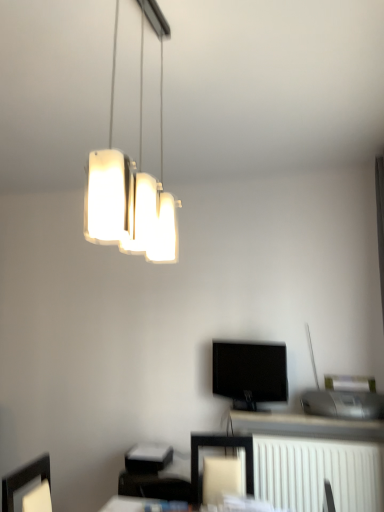
Question: Considering the positions of white plastic radiator at lower right and matte black frame at lower center in the image, is white plastic radiator at lower right wider or thinner than matte black frame at lower center?

Choices:
 (A) wide
 (B) thin

Answer: (B)

Question: Choose the correct answer: Is white plastic radiator at lower right inside matte black frame at lower center or outside it?

Choices:
 (A) inside
 (B) outside

Answer: (B)

Question: Which object is positioned farthest from the matte black frame at lower center?

Choices:
 (A) black glossy tv at center
 (B) white plastic radiator at lower right
 (C) white matte lamp at upper center

Answer: (C)

Question: Estimate the real-world distances between objects in this image. Which object is closer to the white plastic radiator at lower right?

Choices:
 (A) white matte lamp at upper center
 (B) matte black frame at lower center
 (C) black glossy tv at center

Answer: (B)